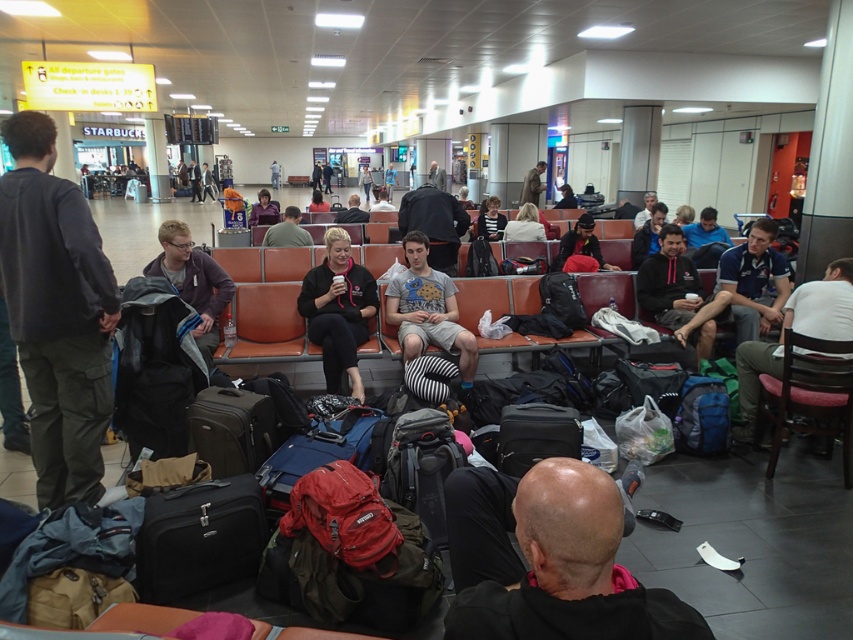
Between point (33, 292) and point (450, 292), which one is positioned in front?

Positioned in front is point (33, 292).

Does dark gray cotton jacket at left have a greater height compared to striped fabric pillow at center?

Yes, dark gray cotton jacket at left is taller than striped fabric pillow at center.

What do you see at coordinates (56, 312) in the screenshot? This screenshot has width=853, height=640. I see `dark gray cotton jacket at left` at bounding box center [56, 312].

Where is `dark gray cotton jacket at left`? The height and width of the screenshot is (640, 853). dark gray cotton jacket at left is located at coordinates (56, 312).

This screenshot has width=853, height=640. Describe the element at coordinates (199, 538) in the screenshot. I see `black hardshell suitcase at lower left` at that location.

Who is positioned more to the left, black hardshell suitcase at lower left or matte black suitcase at center?

matte black suitcase at center

What do you see at coordinates (199, 538) in the screenshot?
I see `black hardshell suitcase at lower left` at bounding box center [199, 538].

Find the location of `black hardshell suitcase at lower left`. black hardshell suitcase at lower left is located at coordinates (199, 538).

Measure the distance between point (x=567, y=556) and camera.

Point (x=567, y=556) is 3.75 feet from camera.

Consider the image. Is black fabric cap at lower center thinner than black hardshell suitcase at lower left?

In fact, black fabric cap at lower center might be wider than black hardshell suitcase at lower left.

Which is behind, point (477, 528) or point (213, 566)?

Positioned behind is point (213, 566).

Find the location of a particular element. black fabric cap at lower center is located at coordinates (548, 561).